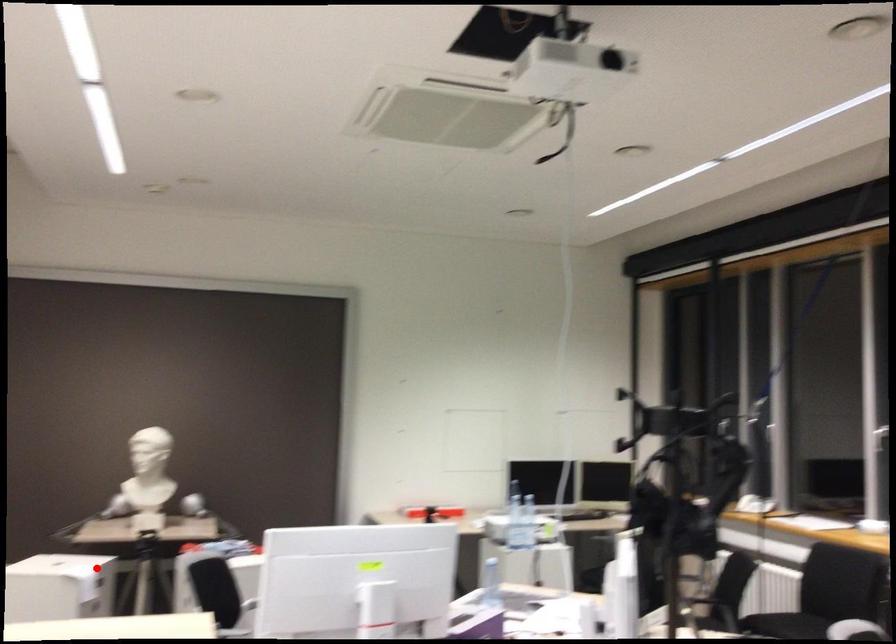
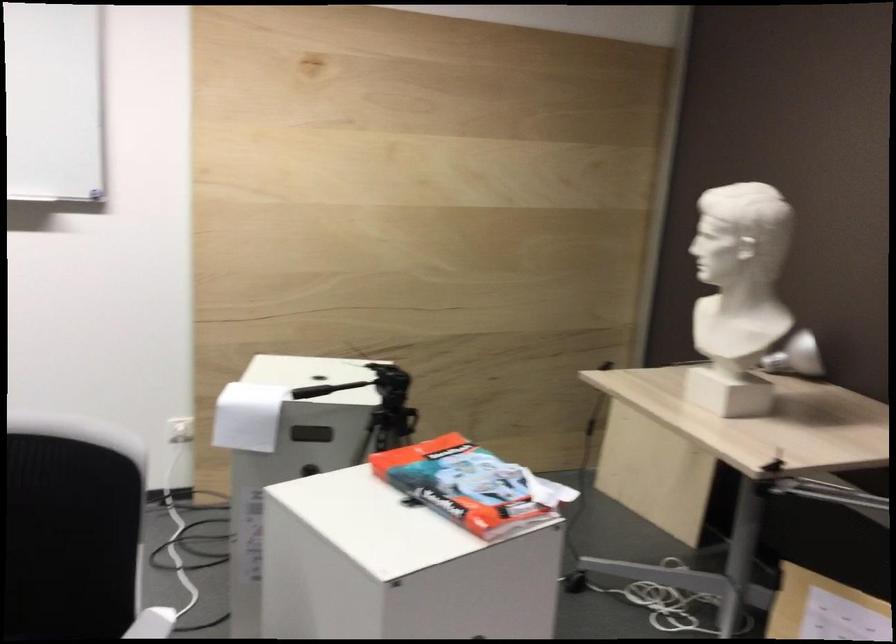
Question: I am providing you with two images of the same scene from different viewpoints. A red point is shown in image1. For the corresponding object point in image2, is it positioned nearer or farther from the camera?

Choices:
 (A) Nearer
 (B) Farther

Answer: (A)